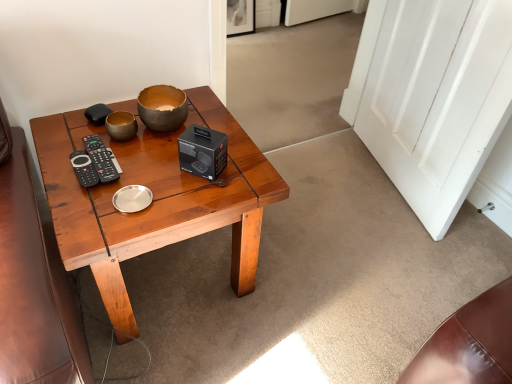
At what (x,y) coordinates should I click in order to perform the action: click on free space in front of white glossy door at right. Please return your answer as a coordinate pair (x, y). Looking at the image, I should click on (365, 259).